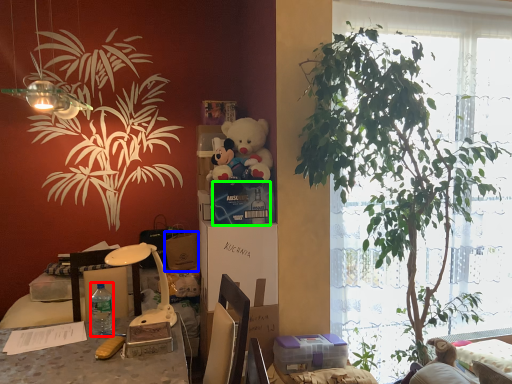
Question: Based on their relative distances, which object is farther from bottle (highlighted by a red box)? Choose from box (highlighted by a blue box) and box (highlighted by a green box).

Choices:
 (A) box
 (B) box

Answer: (B)